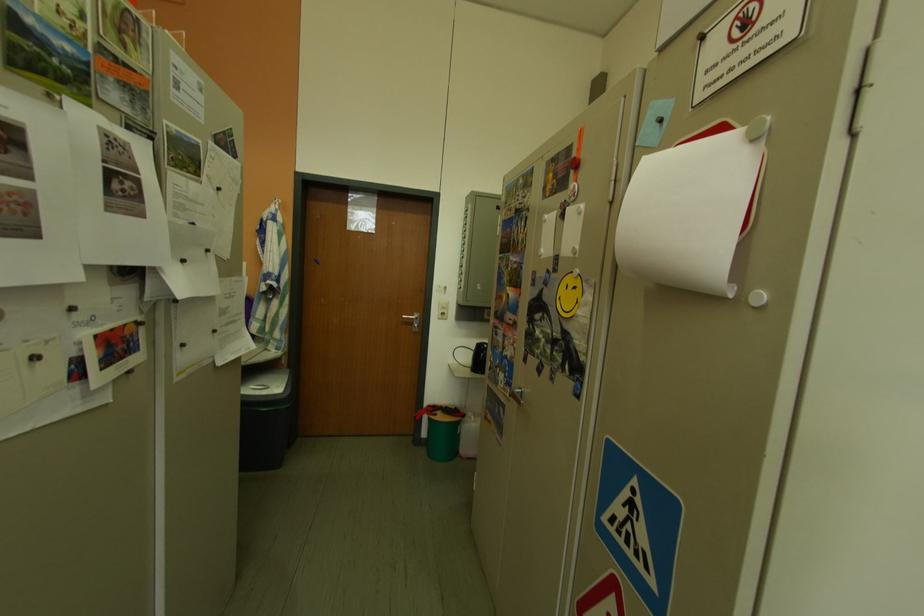
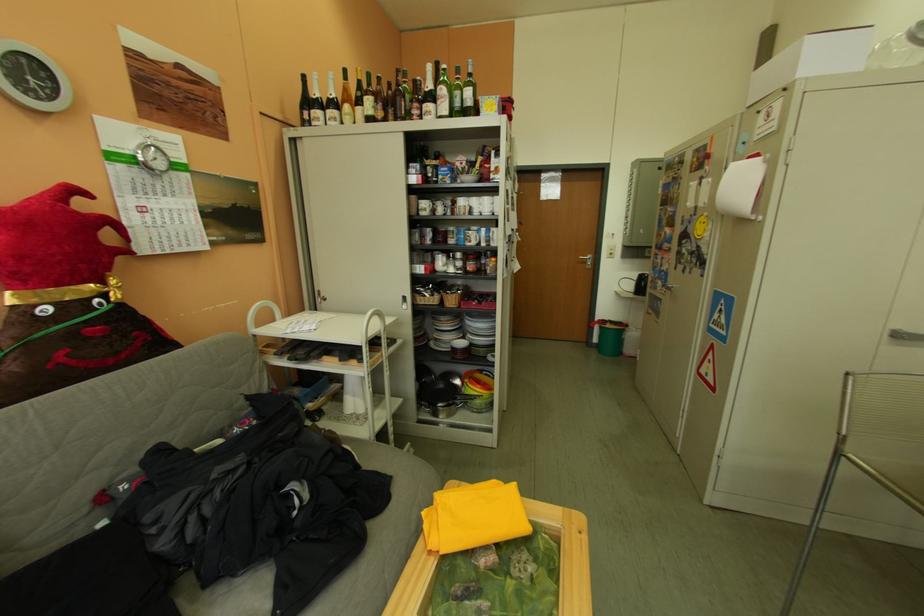
Find the pixel in the second image that matches pixel 590 251 in the first image.

(720, 204)